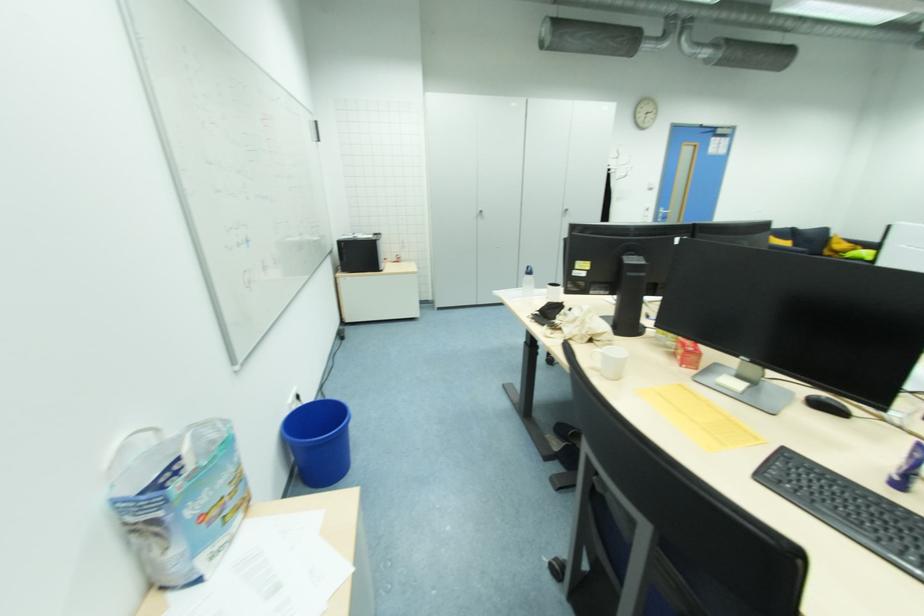
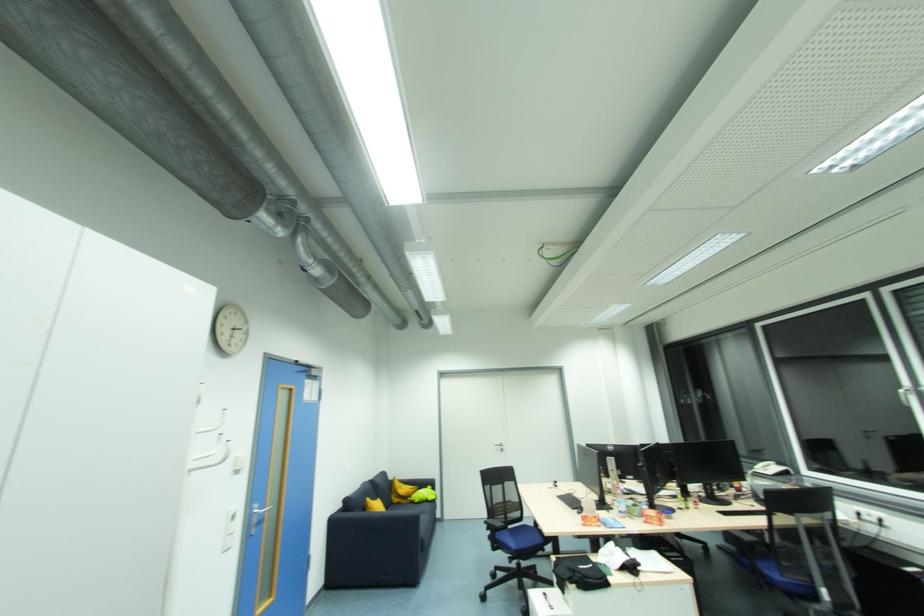
Find the pixel in the second image that matches point (828, 254) in the first image.

(397, 501)